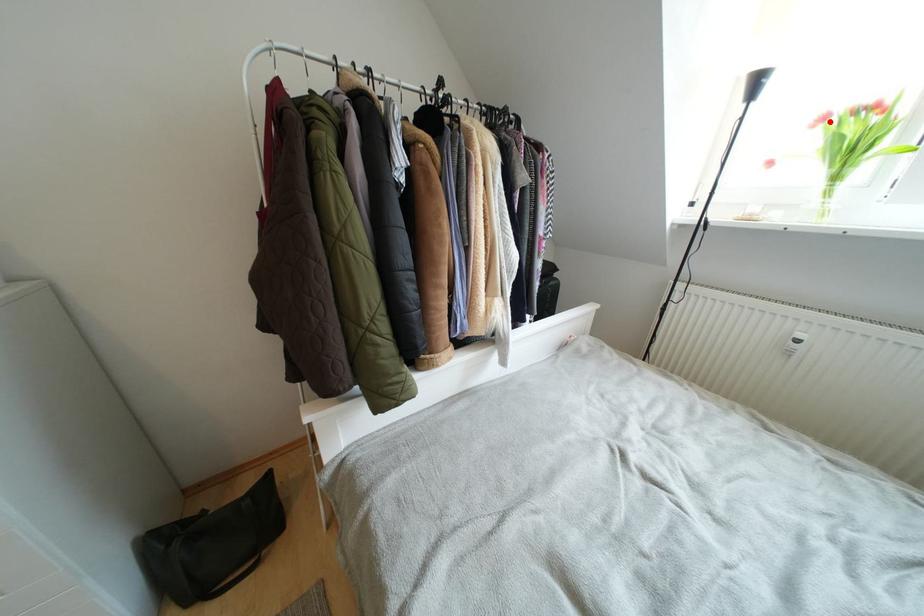
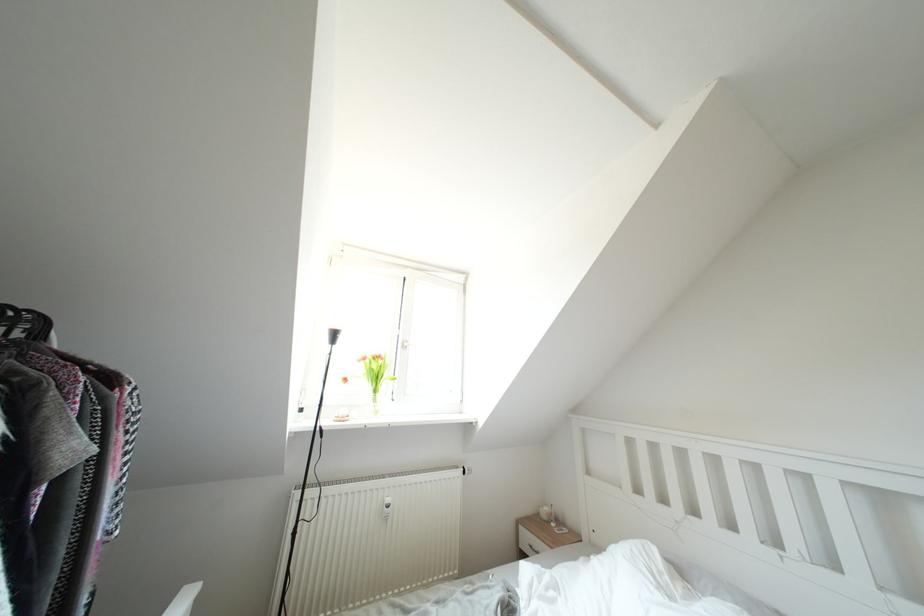
Question: I am providing you with two images of the same scene from different viewpoints. A red point is marked on the first image. Is the red point's position out of view in image 2?

Choices:
 (A) Yes
 (B) No

Answer: (B)